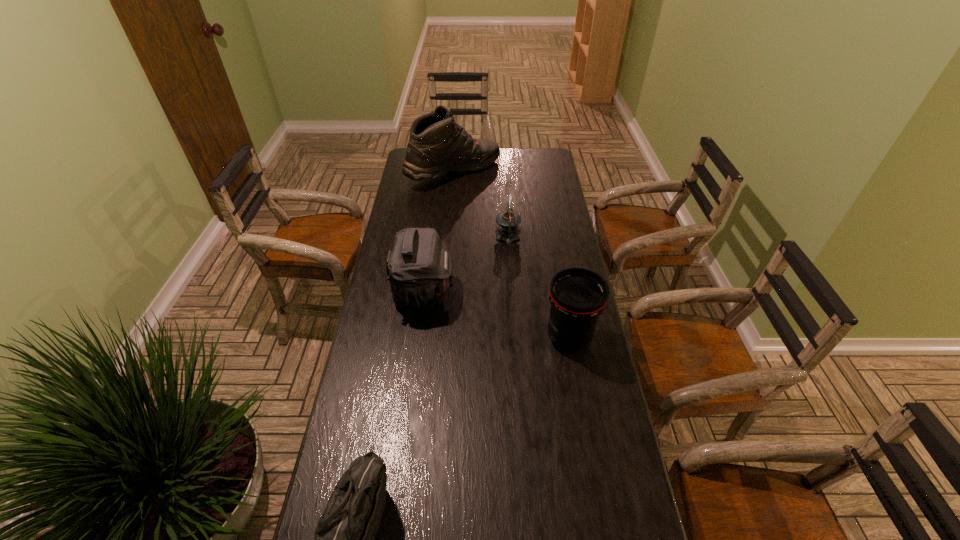
Locate an element on the screen. This screenshot has height=540, width=960. empty space between the taller shoulder bag and the fourth nearest object is located at coordinates coord(466,265).

At what (x,y) coordinates should I click in order to perform the action: click on free space between the ski boot and the farther shoulder bag. Please return your answer as a coordinate pair (x, y). The width and height of the screenshot is (960, 540). Looking at the image, I should click on (439, 232).

Find the location of a particular element. empty location between the oil lamp and the telephoto lens is located at coordinates [x=539, y=288].

Identify the location of unoccupied area between the farthest object and the taller shoulder bag. The image size is (960, 540). (439, 232).

You are a GUI agent. You are given a task and a screenshot of the screen. Output one action in this format:
    pyautogui.click(x=<x>, y=<y>)
    Task: Click on the fourth closest object to the rightmost object
    The image size is (960, 540).
    Given the screenshot: What is the action you would take?
    pyautogui.click(x=437, y=145)

Locate which object is the third closest to the farther shoulder bag. Please provide its 2D coordinates. Your answer should be formatted as a tuple, i.e. [(x, y)], where the tuple contains the x and y coordinates of a point satisfying the conditions above.

[(344, 538)]

Locate an element on the screen. free space in the image that satisfies the following two spatial constraints: 1. on the front side of the oil lamp; 2. on the right side of the farthest object is located at coordinates (448, 238).